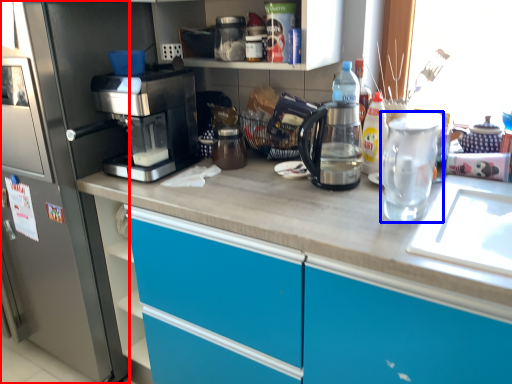
Question: Which point is closer to the camera, home appliance (highlighted by a red box) or tea pot (highlighted by a blue box)?

Choices:
 (A) home appliance
 (B) tea pot

Answer: (B)